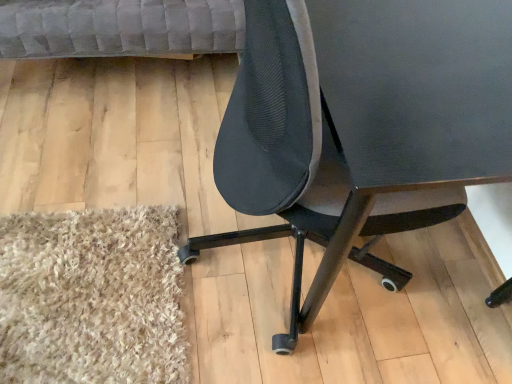
This screenshot has height=384, width=512. What are the coordinates of `black mesh chair at center` in the screenshot? It's located at (361, 126).

What do you see at coordinates (361, 126) in the screenshot? The width and height of the screenshot is (512, 384). I see `black mesh chair at center` at bounding box center [361, 126].

Locate an element on the screen. Image resolution: width=512 pixels, height=384 pixels. black mesh chair at center is located at coordinates (361, 126).